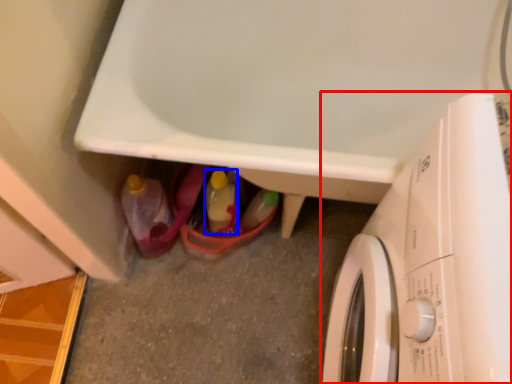
Question: Among these objects, which one is nearest to the camera, washing machine (highlighted by a red box) or bottle (highlighted by a blue box)?

Choices:
 (A) washing machine
 (B) bottle

Answer: (A)